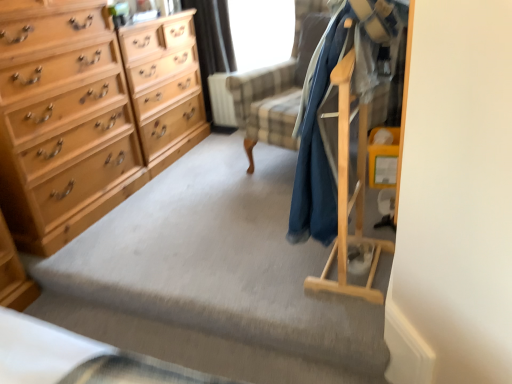
Question: From the image's perspective, relative to light wood chest of drawers at left, is black fabric curtain at upper center above or below?

Choices:
 (A) above
 (B) below

Answer: (A)

Question: Is black fabric curtain at upper center inside or outside of light wood chest of drawers at left?

Choices:
 (A) inside
 (B) outside

Answer: (B)

Question: Estimate the real-world distances between objects in this image. Which object is farther from the light wood/file cabinet at left?

Choices:
 (A) light wood chest of drawers at left
 (B) transparent plastic window screen at upper center
 (C) dark blue fabric coat at right
 (D) black fabric curtain at upper center

Answer: (C)

Question: Based on their relative distances, which object is farther from the light wood/file cabinet at left?

Choices:
 (A) transparent plastic window screen at upper center
 (B) dark blue fabric coat at right
 (C) light wood chest of drawers at left
 (D) black fabric curtain at upper center

Answer: (B)